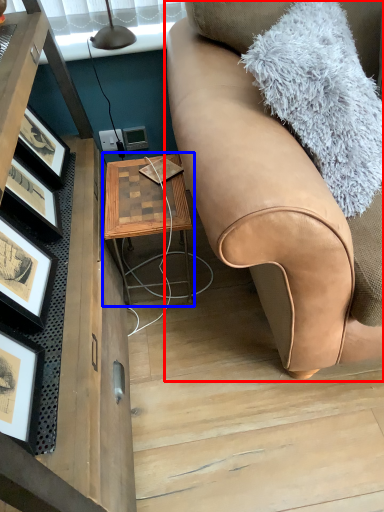
Question: Among these objects, which one is farthest to the camera, studio couch (highlighted by a red box) or table (highlighted by a blue box)?

Choices:
 (A) studio couch
 (B) table

Answer: (B)